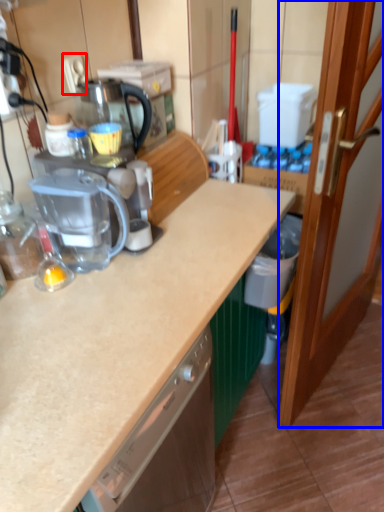
Question: Which object is further to the camera taking this photo, electric outlet (highlighted by a red box) or door (highlighted by a blue box)?

Choices:
 (A) electric outlet
 (B) door

Answer: (A)